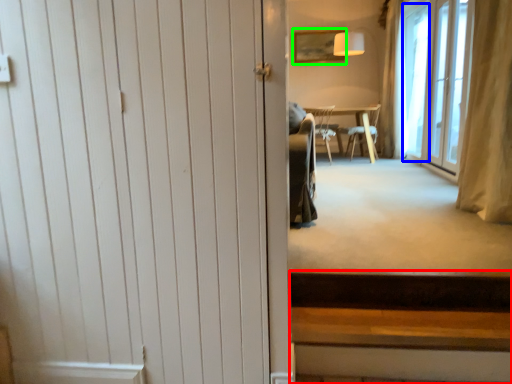
Question: Which object is positioned closest to stairs (highlighted by a red box)? Select from window screen (highlighted by a blue box) and picture frame (highlighted by a green box).

Choices:
 (A) window screen
 (B) picture frame

Answer: (A)